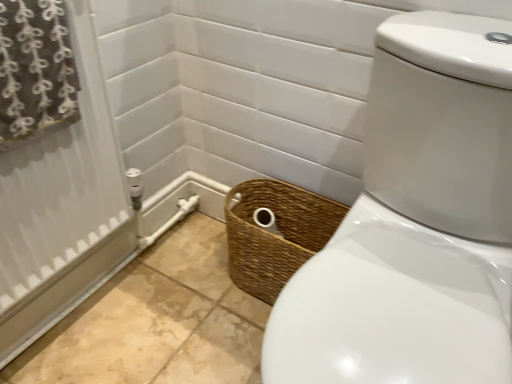
You are a GUI agent. You are given a task and a screenshot of the screen. Output one action in this format:
    pyautogui.click(x=<x>, y=<y>)
    Task: Click on the brown textured fabric at upper left
    
    Given the screenshot: What is the action you would take?
    pyautogui.click(x=35, y=71)

What do you see at coordinates (35, 71) in the screenshot?
I see `brown textured fabric at upper left` at bounding box center [35, 71].

In order to face brown textured fabric at upper left, should I rotate leftwards or rightwards?

Turn left by 28.802 degrees to look at brown textured fabric at upper left.

What do you see at coordinates (275, 235) in the screenshot? This screenshot has height=384, width=512. I see `woven brown basket at lower center` at bounding box center [275, 235].

You are a GUI agent. You are given a task and a screenshot of the screen. Output one action in this format:
    pyautogui.click(x=<x>, y=<y>)
    Task: Click on the woven brown basket at lower center
    This screenshot has height=384, width=512.
    Given the screenshot: What is the action you would take?
    pyautogui.click(x=275, y=235)

In order to face woven brown basket at lower center, should I rotate leftwards or rightwards?

Turn right by 3.021 degrees to look at woven brown basket at lower center.

Measure the distance between point (264, 297) and camera.

They are 3.95 feet apart.

At what (x,y) coordinates should I click in order to perform the action: click on brown textured fabric at upper left. Please return your answer as a coordinate pair (x, y). Image resolution: width=512 pixels, height=384 pixels. Looking at the image, I should click on (35, 71).

Is woven brown basket at lower center at the right side of brown textured fabric at upper left?

Yes.

Relative to brown textured fabric at upper left, is woven brown basket at lower center in front or behind?

woven brown basket at lower center is behind brown textured fabric at upper left.

Which point is more distant from viewer, (247, 238) or (37, 12)?

The point (247, 238) is more distant.

From the image's perspective, is woven brown basket at lower center beneath brown textured fabric at upper left?

Correct, woven brown basket at lower center appears lower than brown textured fabric at upper left in the image.

From a real-world perspective, is woven brown basket at lower center physically above brown textured fabric at upper left?

No, from a real-world perspective, woven brown basket at lower center is not above brown textured fabric at upper left.

Considering the sizes of woven brown basket at lower center and brown textured fabric at upper left in the image, is woven brown basket at lower center wider or thinner than brown textured fabric at upper left?

woven brown basket at lower center is wider than brown textured fabric at upper left.

Between woven brown basket at lower center and brown textured fabric at upper left, which one has less height?

Answer: brown textured fabric at upper left.

Based on the photo, between woven brown basket at lower center and brown textured fabric at upper left, which one has larger size?

Bigger between the two is woven brown basket at lower center.

Is woven brown basket at lower center not inside brown textured fabric at upper left?

Yes, woven brown basket at lower center is not within brown textured fabric at upper left.

Is woven brown basket at lower center next to brown textured fabric at upper left?

woven brown basket at lower center and brown textured fabric at upper left are not in contact.

Could you tell me if woven brown basket at lower center is turned towards brown textured fabric at upper left?

No.

How many degrees apart are the facing directions of woven brown basket at lower center and brown textured fabric at upper left?

There is a 89.8-degree angle between the facing directions of woven brown basket at lower center and brown textured fabric at upper left.

Where is `basket below the brown textured fabric at upper left (from the image's perspective)`? This screenshot has height=384, width=512. basket below the brown textured fabric at upper left (from the image's perspective) is located at coordinates (275, 235).

Does brown textured fabric at upper left appear on the right side of woven brown basket at lower center?

In fact, brown textured fabric at upper left is to the left of woven brown basket at lower center.

Is the position of brown textured fabric at upper left more distant than that of woven brown basket at lower center?

No, it is in front of woven brown basket at lower center.

Does point (0, 119) lie behind point (284, 256)?

No, (0, 119) is in front of (284, 256).

From the image's perspective, does brown textured fabric at upper left appear lower than woven brown basket at lower center?

Incorrect, from the image's perspective, brown textured fabric at upper left is higher than woven brown basket at lower center.

From a real-world perspective, which is physically above, brown textured fabric at upper left or woven brown basket at lower center?

From a 3D spatial view, brown textured fabric at upper left is above.

Is brown textured fabric at upper left wider than woven brown basket at lower center?

No, brown textured fabric at upper left is not wider than woven brown basket at lower center.

Who is taller, brown textured fabric at upper left or woven brown basket at lower center?

woven brown basket at lower center is taller.

Is brown textured fabric at upper left smaller than woven brown basket at lower center?

Indeed, brown textured fabric at upper left has a smaller size compared to woven brown basket at lower center.

Can we say brown textured fabric at upper left lies outside woven brown basket at lower center?

Indeed, brown textured fabric at upper left is completely outside woven brown basket at lower center.

Is brown textured fabric at upper left directly adjacent to woven brown basket at lower center?

They are not placed beside each other.

Is brown textured fabric at upper left oriented towards woven brown basket at lower center?

No, brown textured fabric at upper left does not turn towards woven brown basket at lower center.

Locate an element on the screen. curtain located on the left of woven brown basket at lower center is located at coordinates (35, 71).

The height and width of the screenshot is (384, 512). Find the location of `basket beneath the brown textured fabric at upper left (from a real-world perspective)`. basket beneath the brown textured fabric at upper left (from a real-world perspective) is located at coordinates (275, 235).

Where is `basket located below the brown textured fabric at upper left (from the image's perspective)`? This screenshot has width=512, height=384. basket located below the brown textured fabric at upper left (from the image's perspective) is located at coordinates (275, 235).